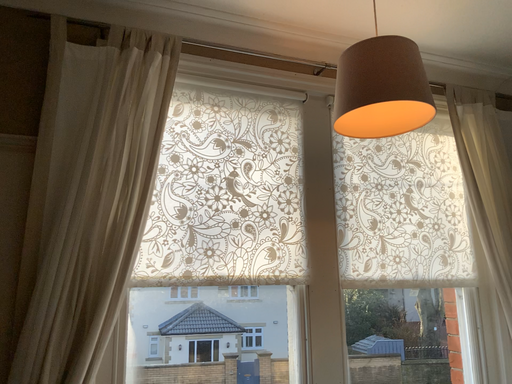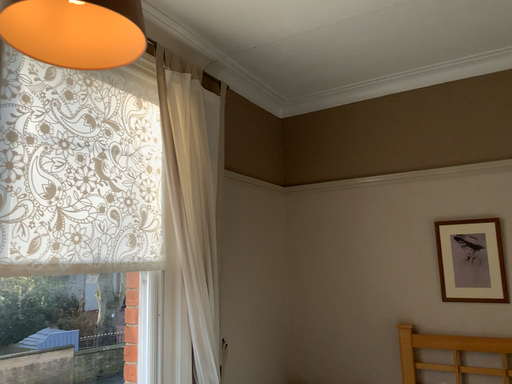
Question: Which way did the camera rotate in the video?

Choices:
 (A) rotated right
 (B) rotated left

Answer: (A)